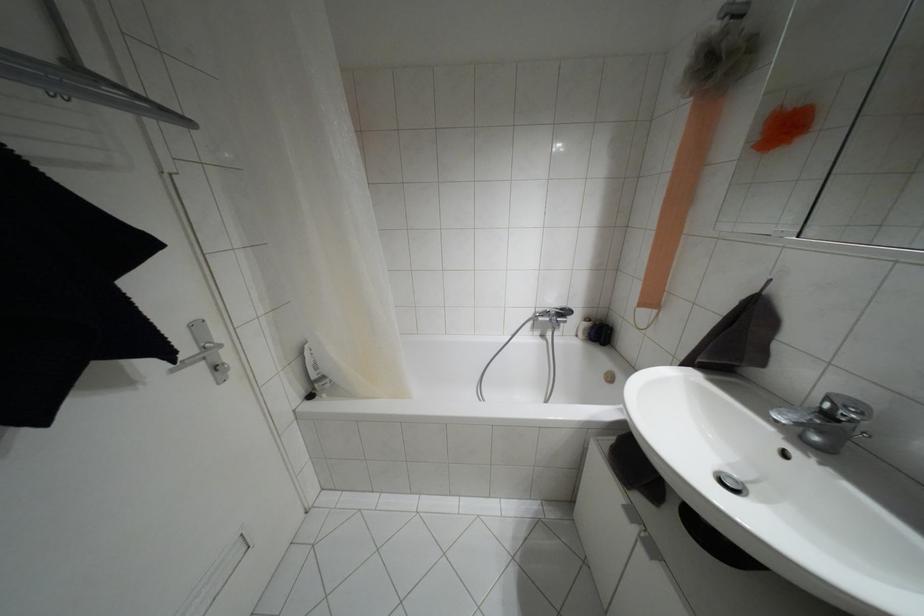
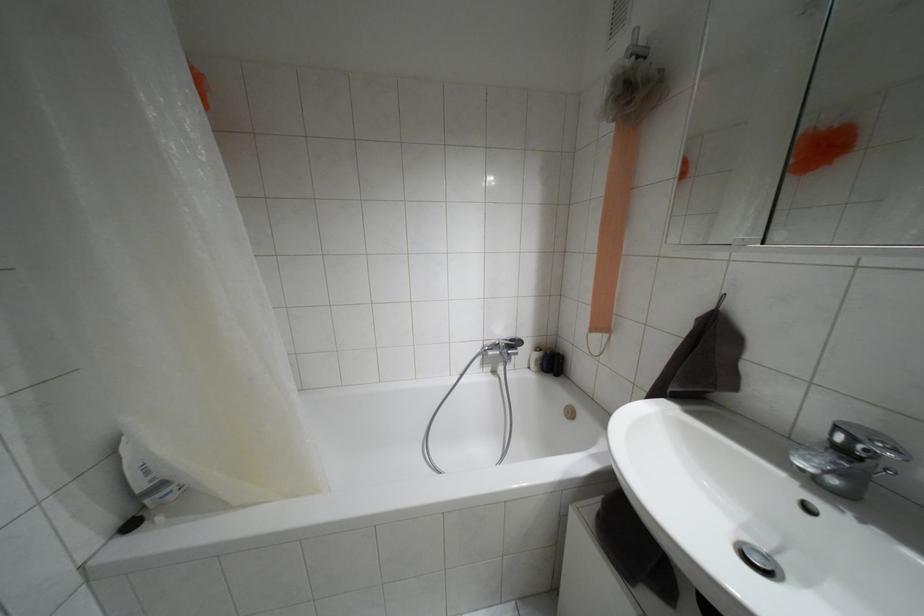
Question: The images are taken continuously from a first-person perspective. In which direction is your viewpoint rotating?

Choices:
 (A) Left
 (B) Right
 (C) Up
 (D) Down

Answer: (B)